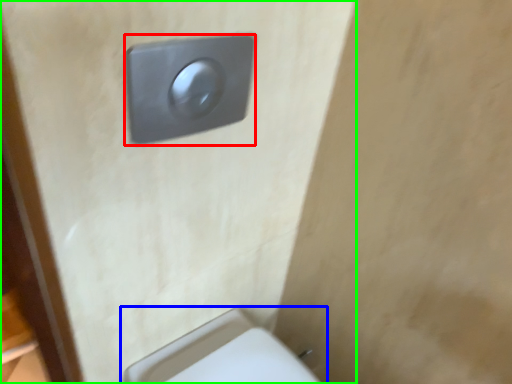
Question: Which object is the closest to the light switch (highlighted by a red box)? Choose among these: toilet (highlighted by a blue box) or door (highlighted by a green box).

Choices:
 (A) toilet
 (B) door

Answer: (B)